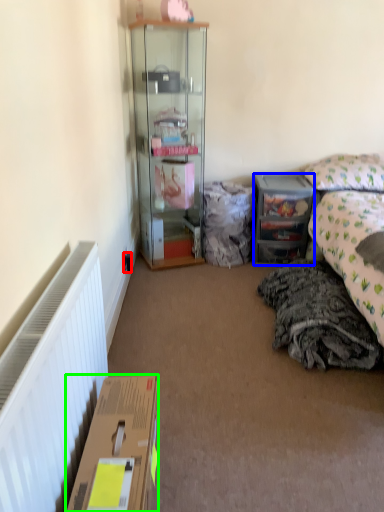
Question: Based on their relative distances, which object is nearer to power outlet (highlighted by a red box)? Choose from desk (highlighted by a blue box) and box (highlighted by a green box).

Choices:
 (A) desk
 (B) box

Answer: (A)